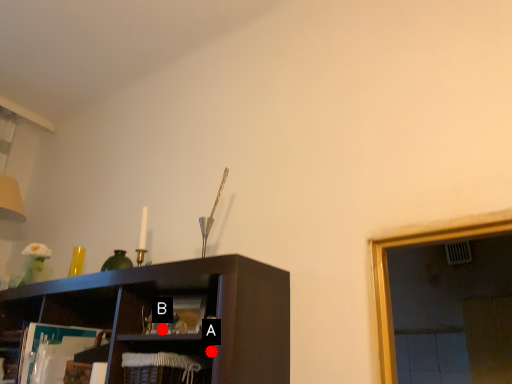
Question: Two points are circled on the image, labeled by A and B beside each circle. Which point is closer to the camera?

Choices:
 (A) A is closer
 (B) B is closer

Answer: (A)